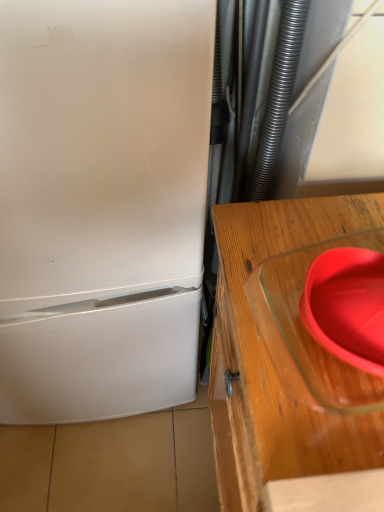
Question: From the image's perspective, does matte glass bowl at right appear lower than white matte refrigerator at left?

Choices:
 (A) no
 (B) yes

Answer: (B)

Question: Considering the relative sizes of matte glass bowl at right and white matte refrigerator at left in the image provided, is matte glass bowl at right taller than white matte refrigerator at left?

Choices:
 (A) no
 (B) yes

Answer: (A)

Question: Is matte glass bowl at right completely or partially outside of white matte refrigerator at left?

Choices:
 (A) yes
 (B) no

Answer: (A)

Question: From the image's perspective, is matte glass bowl at right located above white matte refrigerator at left?

Choices:
 (A) no
 (B) yes

Answer: (A)

Question: Does matte glass bowl at right have a lesser width compared to white matte refrigerator at left?

Choices:
 (A) yes
 (B) no

Answer: (A)

Question: Which is correct: transparent glass table at right is inside matte glass bowl at right, or outside of it?

Choices:
 (A) inside
 (B) outside

Answer: (B)

Question: From their relative heights in the image, would you say transparent glass table at right is taller or shorter than matte glass bowl at right?

Choices:
 (A) short
 (B) tall

Answer: (B)

Question: Considering the relative positions of transparent glass table at right and matte glass bowl at right in the image provided, is transparent glass table at right to the left or to the right of matte glass bowl at right?

Choices:
 (A) left
 (B) right

Answer: (B)

Question: Considering their positions, is transparent glass table at right located in front of or behind matte glass bowl at right?

Choices:
 (A) front
 (B) behind

Answer: (B)

Question: Is white matte refrigerator at left taller or shorter than matte glass bowl at right?

Choices:
 (A) short
 (B) tall

Answer: (B)

Question: From the image's perspective, relative to matte glass bowl at right, is white matte refrigerator at left above or below?

Choices:
 (A) above
 (B) below

Answer: (A)

Question: In the image, is white matte refrigerator at left on the left side or the right side of matte glass bowl at right?

Choices:
 (A) left
 (B) right

Answer: (A)

Question: From a real-world perspective, is white matte refrigerator at left above or below matte glass bowl at right?

Choices:
 (A) below
 (B) above

Answer: (A)

Question: From the image's perspective, is matte glass bowl at right located above or below transparent glass table at right?

Choices:
 (A) above
 (B) below

Answer: (A)

Question: In terms of width, does matte glass bowl at right look wider or thinner when compared to transparent glass table at right?

Choices:
 (A) wide
 (B) thin

Answer: (B)